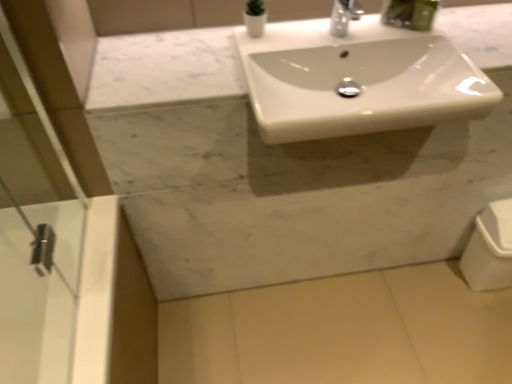
Question: Can we say white glossy trash can at lower right lies outside white glossy vase at upper center?

Choices:
 (A) yes
 (B) no

Answer: (A)

Question: Is white glossy vase at upper center at the back of white glossy trash can at lower right?

Choices:
 (A) yes
 (B) no

Answer: (B)

Question: Is white glossy vase at upper center a part of white glossy trash can at lower right?

Choices:
 (A) no
 (B) yes

Answer: (A)

Question: Is the surface of white glossy trash can at lower right in direct contact with white glossy vase at upper center?

Choices:
 (A) yes
 (B) no

Answer: (B)

Question: Is white glossy trash can at lower right wider than white glossy vase at upper center?

Choices:
 (A) no
 (B) yes

Answer: (B)

Question: Is white glossy trash can at lower right behind white glossy vase at upper center?

Choices:
 (A) no
 (B) yes

Answer: (B)

Question: Are white glossy vase at upper center and white glossy sink at center making contact?

Choices:
 (A) yes
 (B) no

Answer: (B)

Question: Is white glossy vase at upper center located outside white glossy sink at center?

Choices:
 (A) yes
 (B) no

Answer: (A)

Question: Is white glossy vase at upper center facing towards white glossy sink at center?

Choices:
 (A) no
 (B) yes

Answer: (A)

Question: From a real-world perspective, does white glossy vase at upper center sit lower than white glossy sink at center?

Choices:
 (A) yes
 (B) no

Answer: (B)

Question: Is white glossy vase at upper center at the right side of white glossy sink at center?

Choices:
 (A) yes
 (B) no

Answer: (B)

Question: Considering the relative sizes of white glossy vase at upper center and white glossy sink at center in the image provided, is white glossy vase at upper center bigger than white glossy sink at center?

Choices:
 (A) yes
 (B) no

Answer: (B)

Question: Can you see white glossy vase at upper center touching white glossy trash can at lower right?

Choices:
 (A) no
 (B) yes

Answer: (A)